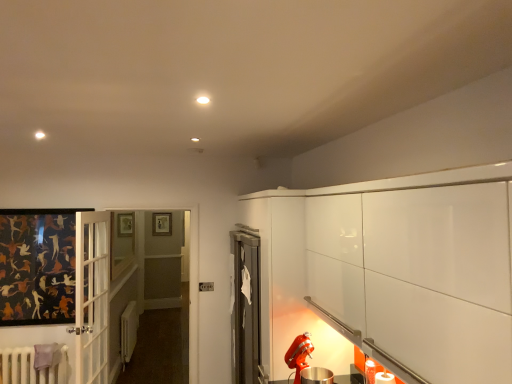
Locate an element on the screen. This screenshot has height=384, width=512. vacant area located to the right-hand side of white matte radiator at lower left, marked as the 2th radiator in a front-to-back arrangement is located at coordinates (160, 360).